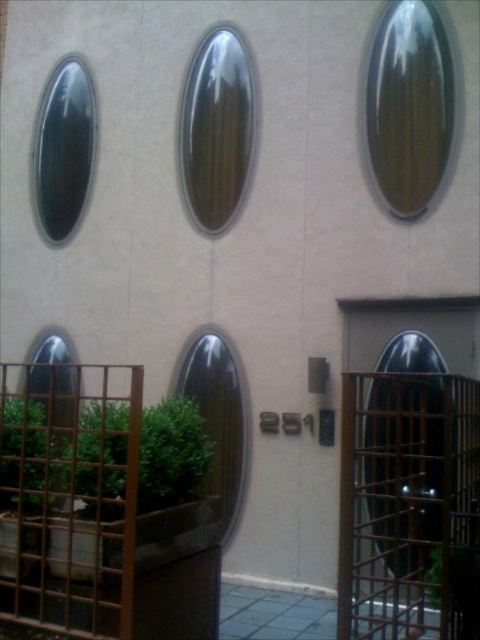
Question: Which object is closer to the camera taking this photo?

Choices:
 (A) black glass door at center
 (B) glossy glass oval at center
 (C) matte black oval at upper left

Answer: (A)

Question: Does glossy metallic oval at upper right have a lesser width compared to glossy glass oval at center?

Choices:
 (A) yes
 (B) no

Answer: (A)

Question: Is black glass door at center below glossy glass oval at center?

Choices:
 (A) no
 (B) yes

Answer: (B)

Question: Based on their relative distances, which object is nearer to the black glass door at center?

Choices:
 (A) glossy glass oval at center
 (B) glossy metallic oval at upper right

Answer: (B)

Question: Which is farther from the matte black oval at upper left?

Choices:
 (A) black glass door at center
 (B) glossy glass oval at center

Answer: (A)

Question: Does black glass door at center appear under glossy metallic oval at upper right?

Choices:
 (A) no
 (B) yes

Answer: (B)